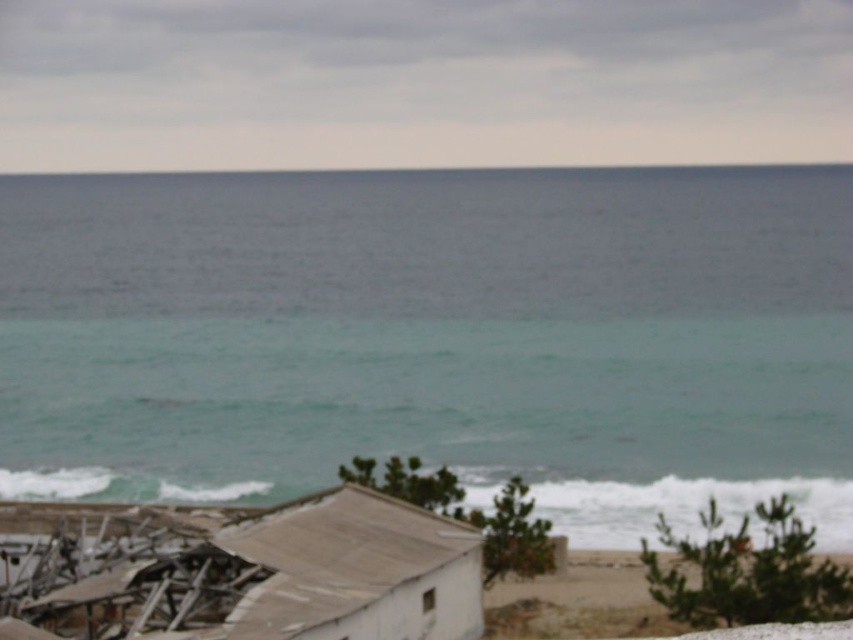
Question: Which of the following is the closest to the observer?

Choices:
 (A) (824, 390)
 (B) (480, 547)

Answer: (B)

Question: Can you confirm if teal water at center is positioned above white corrugated metal hut at lower left?

Choices:
 (A) no
 (B) yes

Answer: (B)

Question: Which object is farther from the camera taking this photo?

Choices:
 (A) white corrugated metal hut at lower left
 (B) teal water at center

Answer: (B)

Question: Observing the image, what is the correct spatial positioning of teal water at center in reference to white corrugated metal hut at lower left?

Choices:
 (A) left
 (B) right

Answer: (B)

Question: Can you confirm if teal water at center is positioned to the left of white corrugated metal hut at lower left?

Choices:
 (A) no
 (B) yes

Answer: (A)